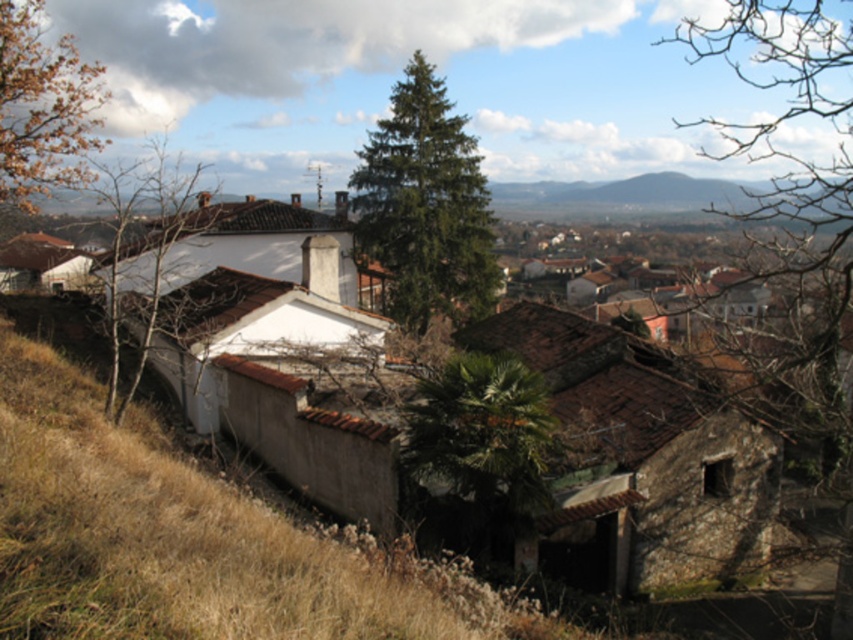
Question: Which point is closer to the camera taking this photo?

Choices:
 (A) (312, 452)
 (B) (729, 122)
 (C) (54, 186)

Answer: (A)

Question: Is brown leafy tree at left to the left of bare branches at center from the viewer's perspective?

Choices:
 (A) no
 (B) yes

Answer: (B)

Question: Which of these objects is positioned closest to the bare branches at center?

Choices:
 (A) bare branches at right
 (B) green leafy palm at center
 (C) brown clay wall at lower left

Answer: (B)

Question: Considering the relative positions of brown clay wall at lower left and bare branches at center in the image provided, where is brown clay wall at lower left located with respect to bare branches at center?

Choices:
 (A) above
 (B) below

Answer: (B)

Question: Which of the following is the farthest from the observer?

Choices:
 (A) brown leafy tree at left
 (B) green needle-like tree at center

Answer: (B)

Question: Is brown clay wall at lower left positioned behind bare branches at center?

Choices:
 (A) no
 (B) yes

Answer: (A)